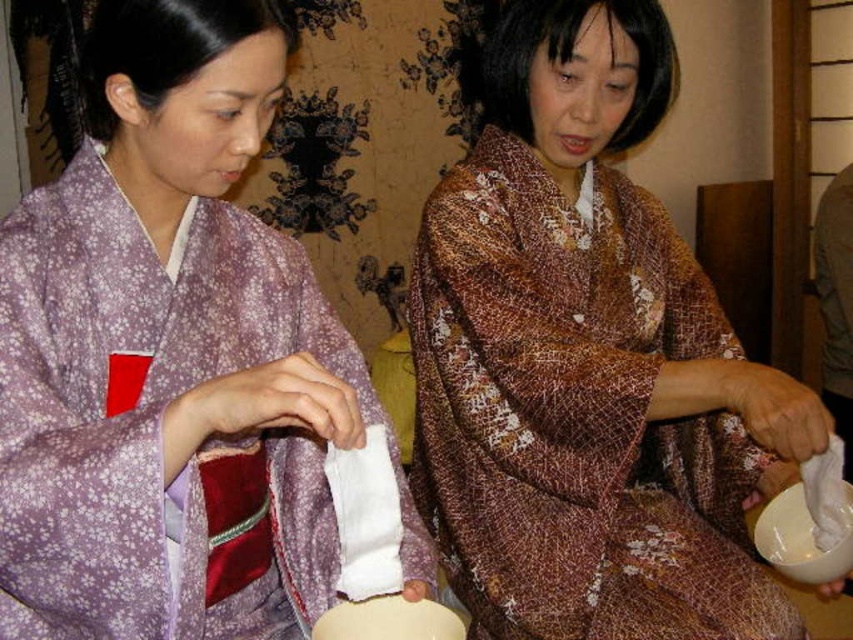
Question: Does purple floral kimono at center have a larger size compared to white fabric at lower right?

Choices:
 (A) no
 (B) yes

Answer: (B)

Question: Can you confirm if matte white bowl at lower center is thinner than white fabric at lower right?

Choices:
 (A) no
 (B) yes

Answer: (A)

Question: Which point is farther to the camera?

Choices:
 (A) (415, 600)
 (B) (566, 348)
 (C) (172, 61)
 (D) (846, 493)

Answer: (D)

Question: Among these points, which one is farthest from the camera?

Choices:
 (A) (463, 634)
 (B) (96, 394)
 (C) (846, 516)

Answer: (C)

Question: Considering the real-world distances, which object is closest to the white fabric at lower right?

Choices:
 (A) matte white bowl at lower center
 (B) purple floral kimono at center
 (C) brown textured kimono at center
 (D) white matte bowl at lower right

Answer: (D)

Question: Is purple floral kimono at center in front of matte white bowl at lower center?

Choices:
 (A) no
 (B) yes

Answer: (B)